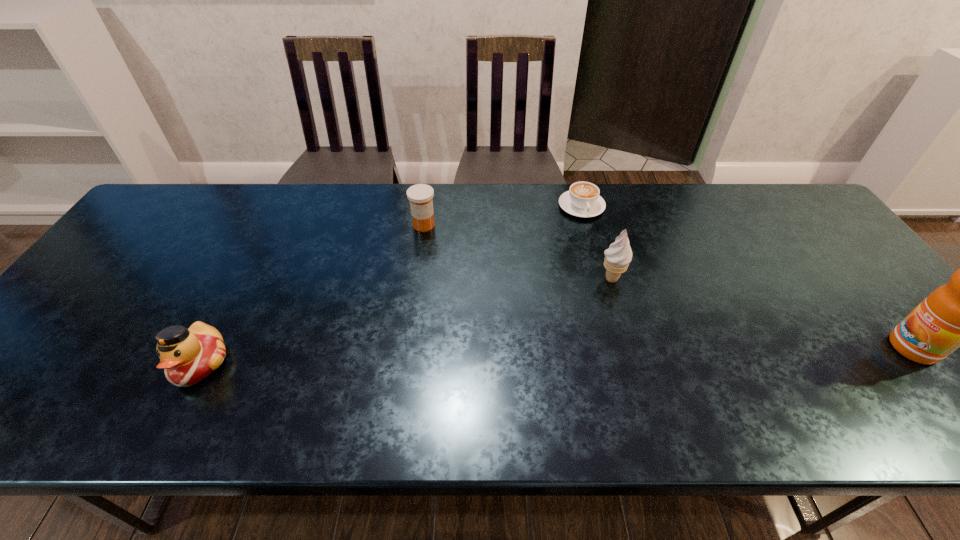
This screenshot has height=540, width=960. In order to click on free space between the fruit juice and the fourth object from right to left in this screenshot , I will do `click(668, 286)`.

Identify the location of free point between the cappuccino and the fourth object from right to left. (503, 215).

The height and width of the screenshot is (540, 960). Find the location of `unoccupied area between the cappuccino and the third farthest object`. unoccupied area between the cappuccino and the third farthest object is located at coordinates (596, 242).

Identify the location of object that is the closest to the second tallest object. Image resolution: width=960 pixels, height=540 pixels. (583, 200).

Locate an element on the screen. This screenshot has height=540, width=960. object that is the third closest to the medicine is located at coordinates (187, 356).

Find the location of a particular element. This screenshot has height=540, width=960. free spot that satisfies the following two spatial constraints: 1. on the front side of the second object from left to right; 2. on the label side of the rightmost object is located at coordinates (407, 348).

The height and width of the screenshot is (540, 960). Identify the location of free spot that satisfies the following two spatial constraints: 1. on the front side of the third nearest object; 2. on the left side of the cappuccino. (600, 278).